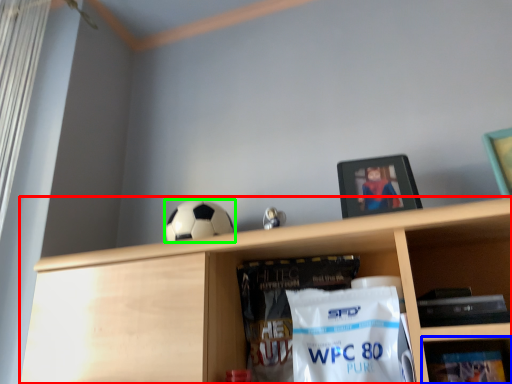
Question: Considering the real-world distances, which object is closest to shelf (highlighted by a red box)? shelf (highlighted by a blue box) or football (highlighted by a green box).

Choices:
 (A) shelf
 (B) football

Answer: (B)